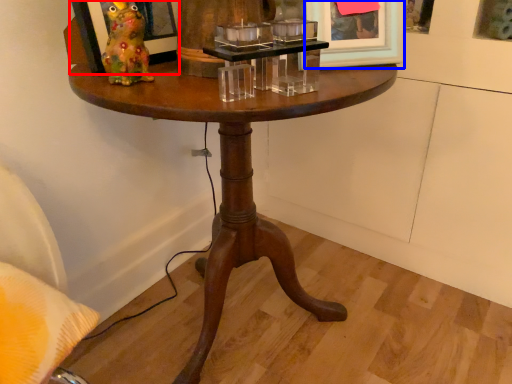
Question: Which object appears farthest to the camera in this image, picture frame (highlighted by a red box) or picture frame (highlighted by a blue box)?

Choices:
 (A) picture frame
 (B) picture frame

Answer: (B)